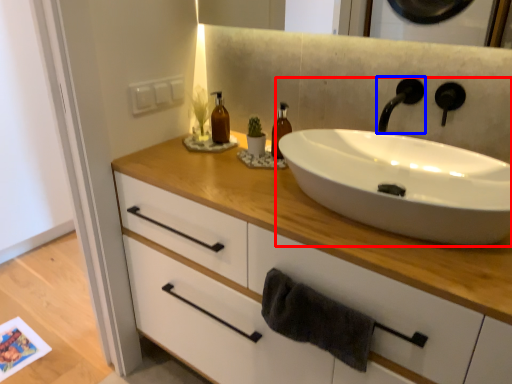
Question: Which of the following is the farthest to the observer, sink (highlighted by a red box) or tap (highlighted by a blue box)?

Choices:
 (A) sink
 (B) tap

Answer: (B)